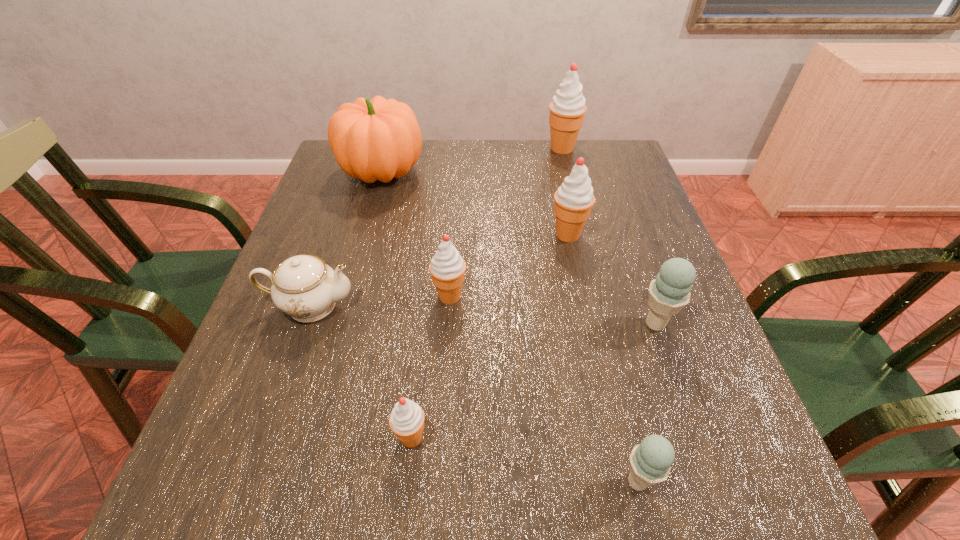
Locate an element on the screen. blank space located on the left of the nearest ice cream is located at coordinates (560, 482).

Image resolution: width=960 pixels, height=540 pixels. Identify the location of icecream that is positioned at the far edge. (567, 109).

Find the location of `pumpkin positioned at the far edge`. pumpkin positioned at the far edge is located at coordinates (378, 139).

This screenshot has width=960, height=540. Identify the location of object located in the near edge section of the desktop. (650, 462).

Locate an element on the screen. pumpkin that is at the left edge is located at coordinates (378, 139).

The height and width of the screenshot is (540, 960). In order to click on chinaware present at the left edge in this screenshot , I will do `click(303, 286)`.

Identify the location of object located in the far left corner section of the desktop. The image size is (960, 540). (378, 139).

I want to click on object at the far right corner, so click(x=567, y=109).

The width and height of the screenshot is (960, 540). I want to click on vacant space at the far edge of the desktop, so click(506, 180).

Locate an element on the screen. This screenshot has width=960, height=540. vacant space at the near edge of the desktop is located at coordinates (359, 470).